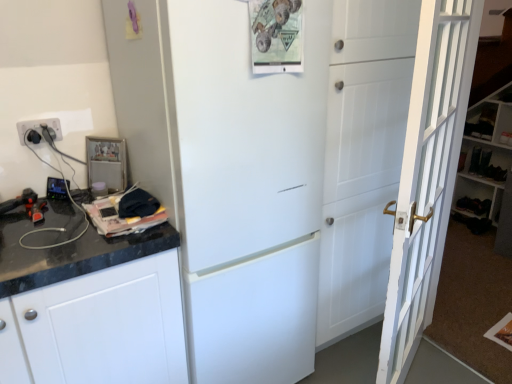
Question: From the image's perspective, does white plastic electrical outlet at left appear lower than metallic photo frame at upper left?

Choices:
 (A) no
 (B) yes

Answer: (A)

Question: Is white plastic electrical outlet at left bigger than metallic photo frame at upper left?

Choices:
 (A) yes
 (B) no

Answer: (B)

Question: Is white plastic electrical outlet at left positioned in front of metallic photo frame at upper left?

Choices:
 (A) no
 (B) yes

Answer: (B)

Question: Is white plastic electrical outlet at left not inside metallic photo frame at upper left?

Choices:
 (A) yes
 (B) no

Answer: (A)

Question: From a real-world perspective, is white plastic electrical outlet at left physically below metallic photo frame at upper left?

Choices:
 (A) yes
 (B) no

Answer: (B)

Question: Considering the relative positions of white plastic electrical outlet at left and metallic photo frame at upper left in the image provided, is white plastic electrical outlet at left to the left of metallic photo frame at upper left from the viewer's perspective?

Choices:
 (A) no
 (B) yes

Answer: (B)

Question: Does white matte refrigerator at center turn towards white wooden door at right?

Choices:
 (A) no
 (B) yes

Answer: (A)

Question: Is the position of white matte refrigerator at center less distant than that of white wooden door at right?

Choices:
 (A) no
 (B) yes

Answer: (A)

Question: Considering the relative sizes of white matte refrigerator at center and white wooden door at right in the image provided, is white matte refrigerator at center thinner than white wooden door at right?

Choices:
 (A) yes
 (B) no

Answer: (B)

Question: Is white matte refrigerator at center touching white wooden door at right?

Choices:
 (A) yes
 (B) no

Answer: (B)

Question: Can you confirm if white matte refrigerator at center is wider than white wooden door at right?

Choices:
 (A) yes
 (B) no

Answer: (A)

Question: Does white matte refrigerator at center have a greater height compared to white wooden door at right?

Choices:
 (A) no
 (B) yes

Answer: (B)

Question: Is white plastic electrical outlet at left wider than white wooden bookshelf at right?

Choices:
 (A) no
 (B) yes

Answer: (A)